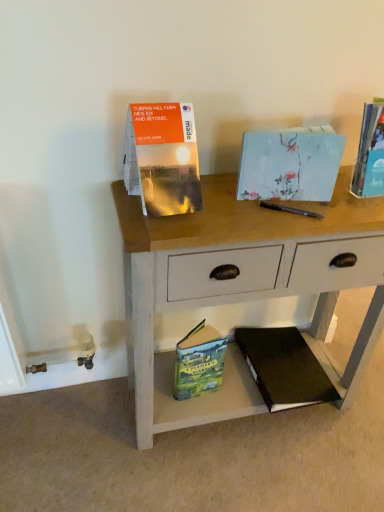
This screenshot has width=384, height=512. In order to click on vacant area that is in front of hardcover book at upper right, positioned as the first paperback book in top-to-bottom order in this screenshot , I will do `click(355, 212)`.